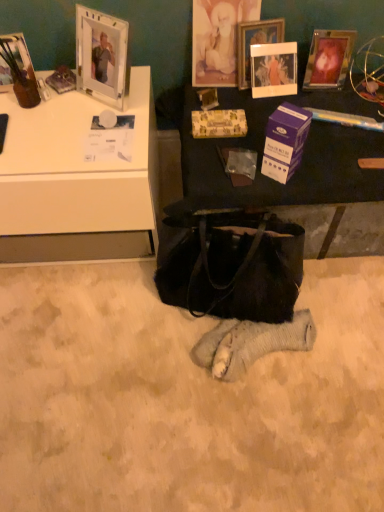
Where is `space that is in front of metallic silver picture frame at upper right, placed as the first picture frame when sorted from right to left`? This screenshot has height=512, width=384. space that is in front of metallic silver picture frame at upper right, placed as the first picture frame when sorted from right to left is located at coordinates (344, 114).